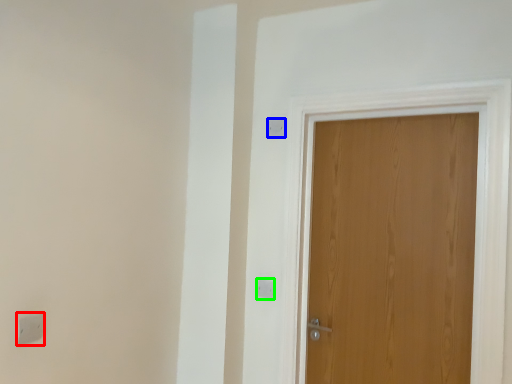
Question: Considering the real-world distances, which object is closest to light switch (highlighted by a red box)? light switch (highlighted by a blue box) or light switch (highlighted by a green box).

Choices:
 (A) light switch
 (B) light switch

Answer: (B)